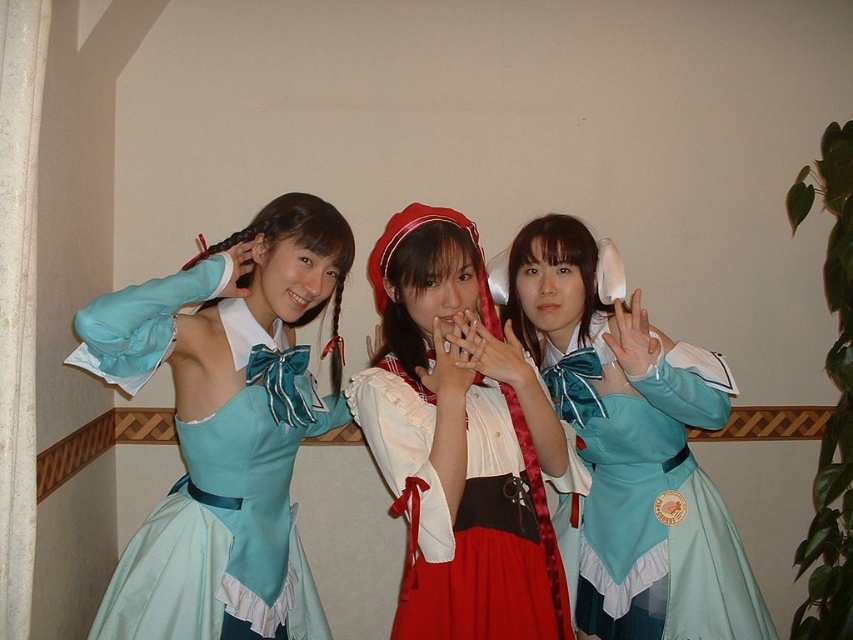
You are organizing a cosplay event and need to ensure that the costumes are arranged by size. You have the matte blue dress at left and the matte white blouse at center. Which costume should be placed first in the order from largest to smallest?

The matte blue dress at left should be placed first in the order from largest to smallest since it is bigger than the matte white blouse at center.

You are trying to locate the matte blue dress at left in the image. According to the scene description, where exactly is it positioned?

The matte blue dress at left is located at point (225, 426).